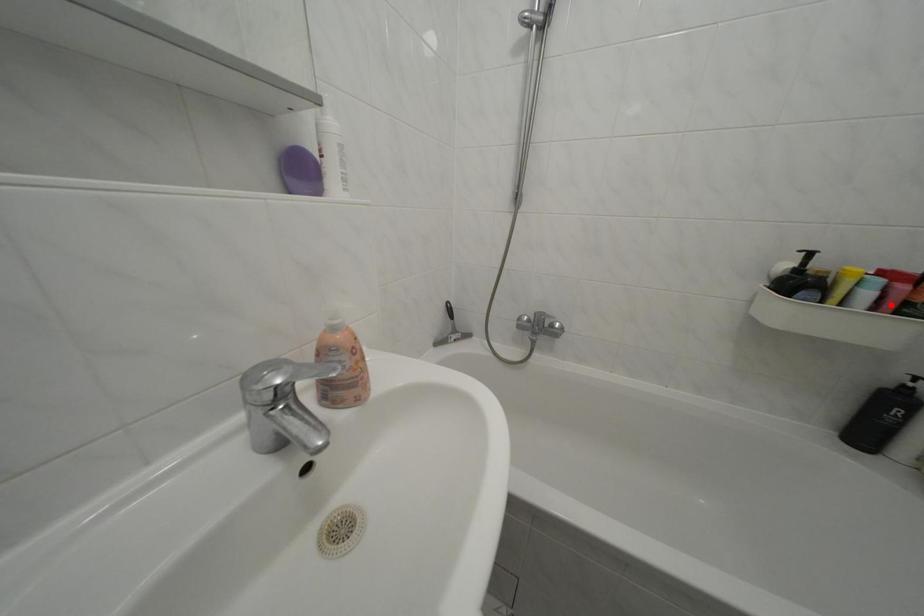
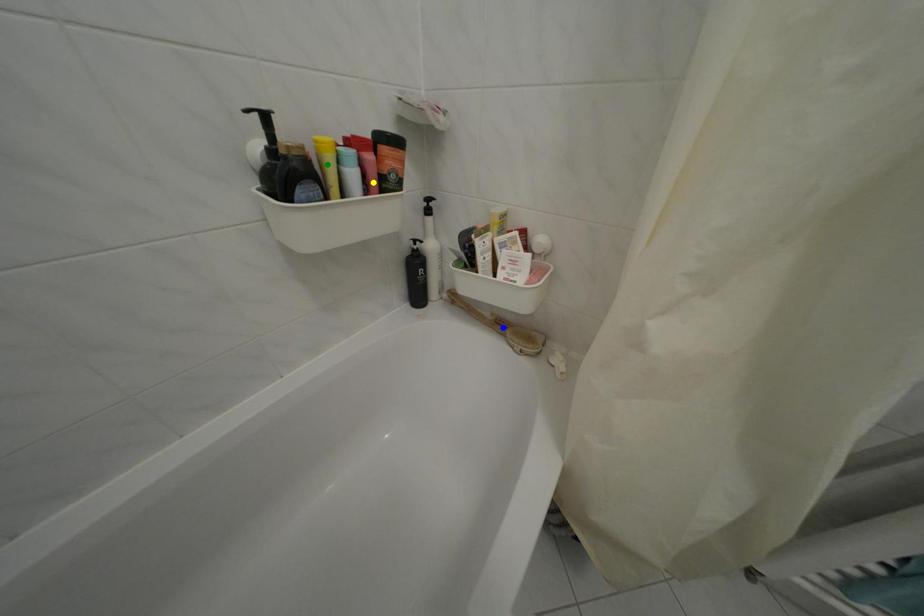
Question: I am providing you with two images of the same scene from different viewpoints. A red point is marked on the first image. You are given multiple points on the second image. In image 2, which mark is for the same physical point as the one in image 1?

Choices:
 (A) blue point
 (B) yellow point
 (C) green point

Answer: (B)